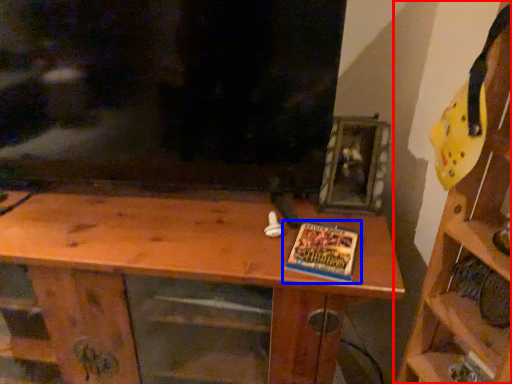
Question: Which object appears farthest to the camera in this image, shelf (highlighted by a red box) or book (highlighted by a blue box)?

Choices:
 (A) shelf
 (B) book

Answer: (B)